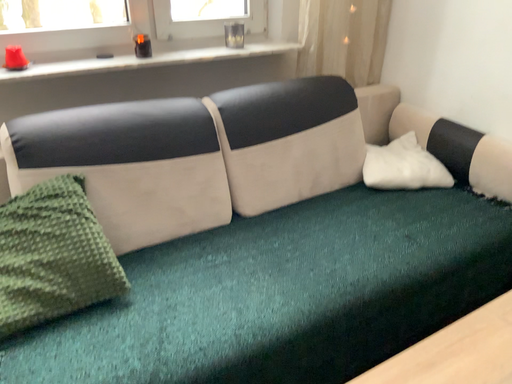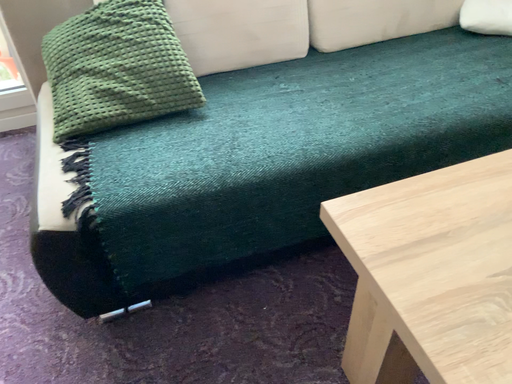
Question: Which way did the camera rotate in the video?

Choices:
 (A) rotated left
 (B) rotated right

Answer: (A)